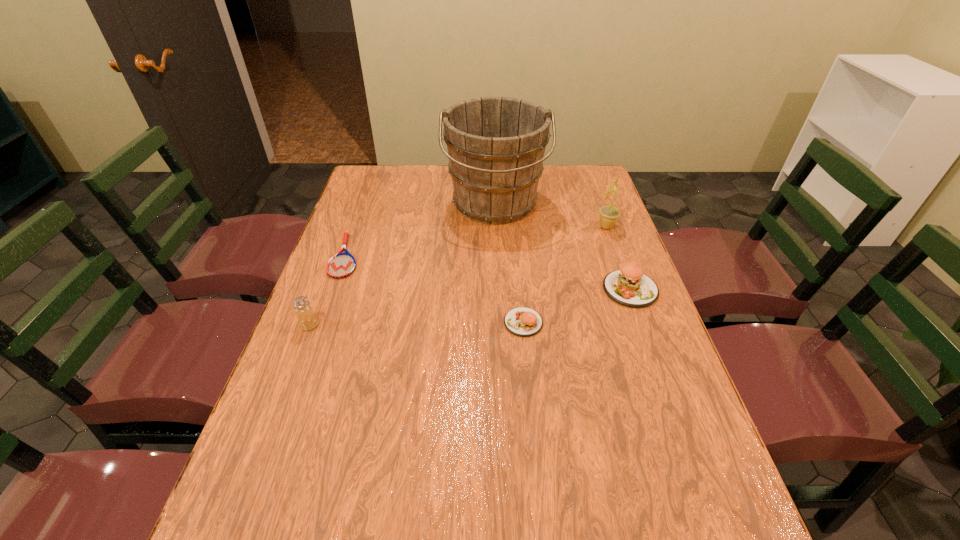
Please show where to add a patty on the left while keeping spacing even. Please provide its 2D coordinates. Your answer should be formatted as a tuple, i.e. [(x, y)], where the tuple contains the x and y coordinates of a point satisfying the conditions above.

[(397, 362)]